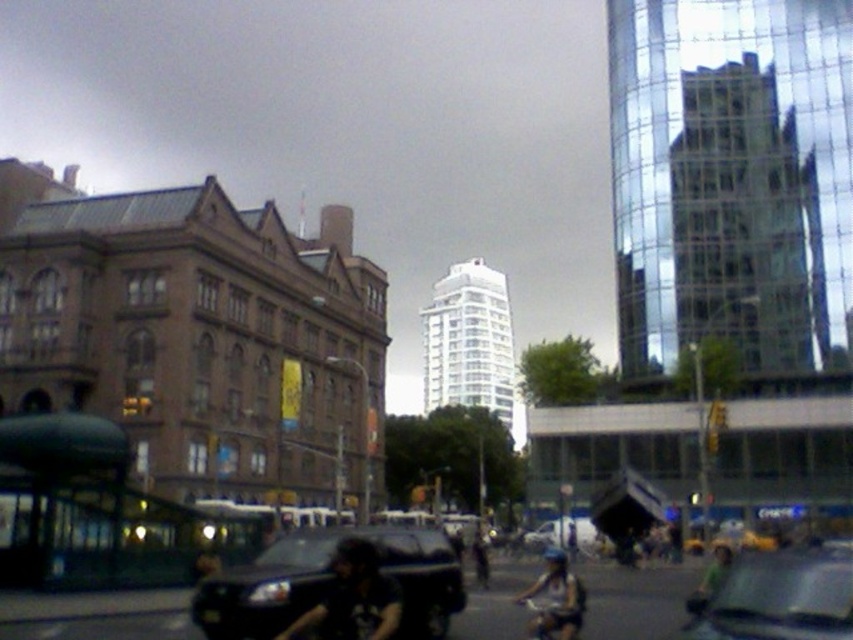
Question: Which of the following is the closest to the observer?

Choices:
 (A) (709, 572)
 (B) (833, 598)
 (C) (564, 621)

Answer: (B)

Question: Does shiny black car at lower left have a lesser width compared to dark blue shirt at center?

Choices:
 (A) no
 (B) yes

Answer: (A)

Question: Which point appears farthest from the camera in this image?

Choices:
 (A) (553, 548)
 (B) (534, 532)

Answer: (B)

Question: Is shiny black car at lower left smaller than metallic silver car at center?

Choices:
 (A) no
 (B) yes

Answer: (B)

Question: Among these objects, which one is farthest from the camera?

Choices:
 (A) shiny black car at lower left
 (B) dark blue shirt at center

Answer: (B)

Question: Is shiny black car at lower left positioned in front of green fabric bicycle at center?

Choices:
 (A) no
 (B) yes

Answer: (A)